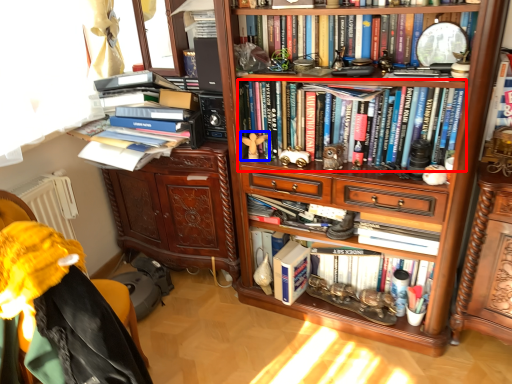
Question: Which object is further to the camera taking this photo, book (highlighted by a red box) or toy (highlighted by a blue box)?

Choices:
 (A) book
 (B) toy

Answer: (B)